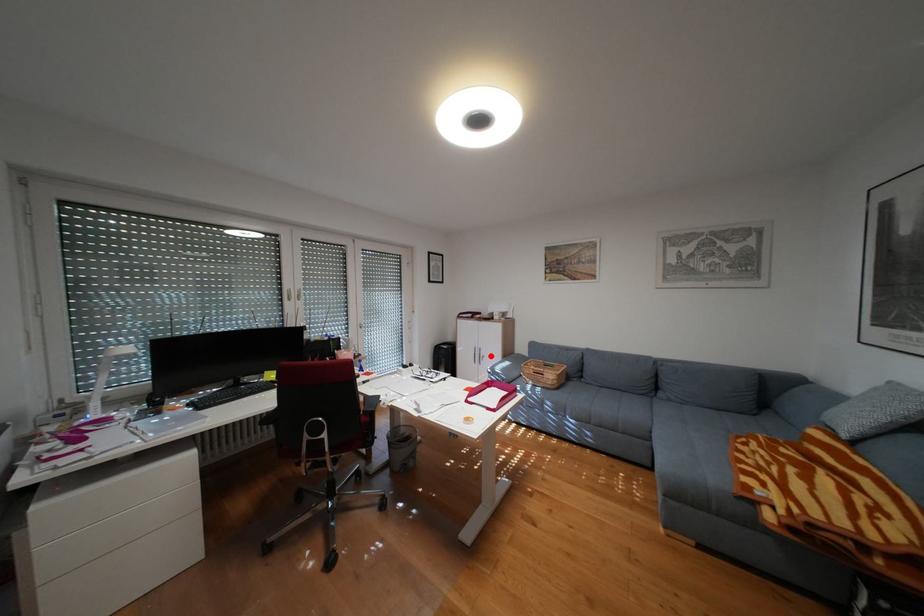
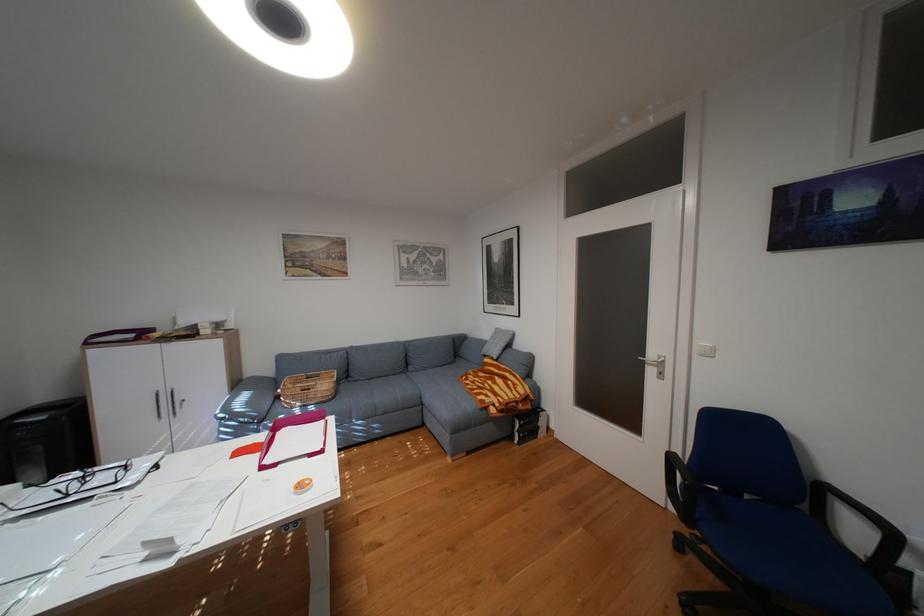
Question: I am providing you with two images of the same scene from different viewpoints. Image1 has a red point marked. In image2, the corresponding 3D location appears at what relative position? Reply with the corresponding letter.

Choices:
 (A) Closer
 (B) Farther

Answer: (A)